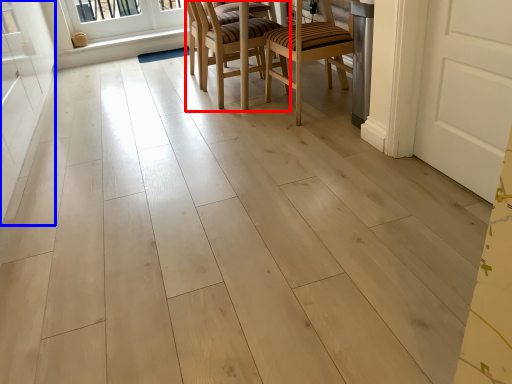
Question: Among these objects, which one is farthest to the camera, chair (highlighted by a red box) or screen door (highlighted by a blue box)?

Choices:
 (A) chair
 (B) screen door

Answer: (A)